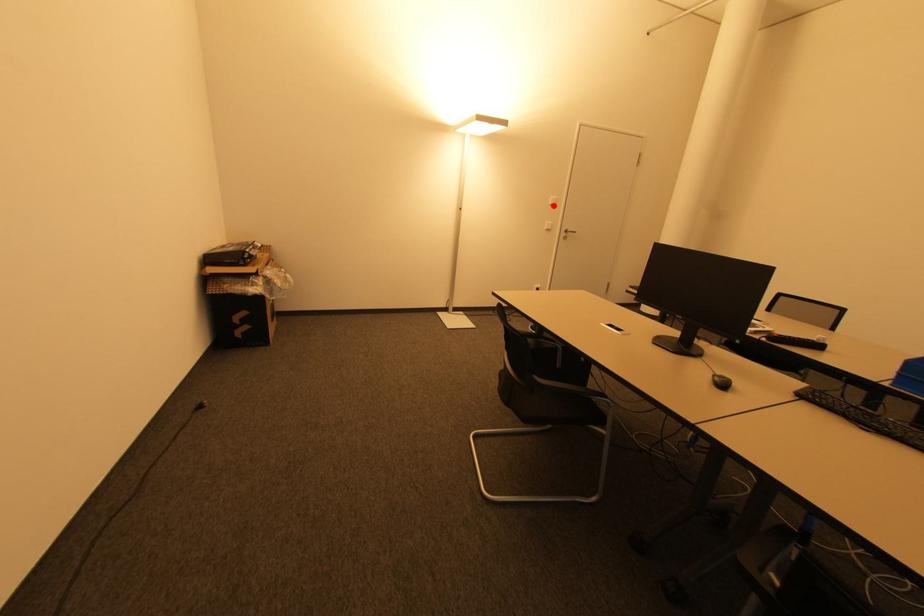
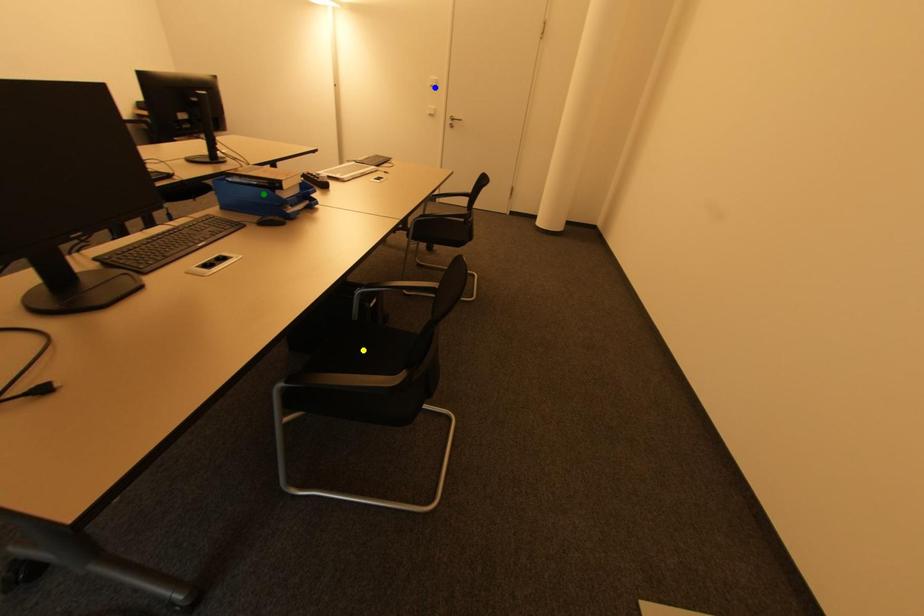
Question: I am providing you with two images of the same scene from different viewpoints. A red point is marked on the first image. You are given multiple points on the second image. Which mark in image 2 goes with the point in image 1?

Choices:
 (A) green point
 (B) yellow point
 (C) blue point

Answer: (C)